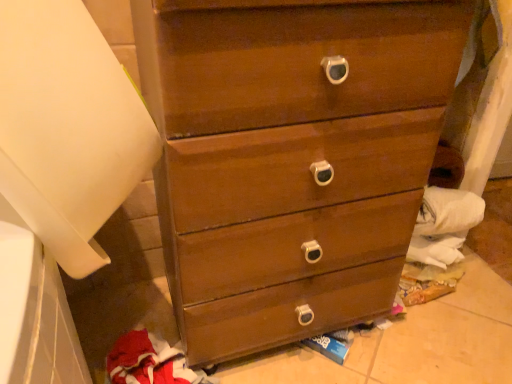
Question: From the image's perspective, relative to white matte paper towel at left, is matte wood chest of drawers at center above or below?

Choices:
 (A) below
 (B) above

Answer: (A)

Question: Looking at the image, does matte wood chest of drawers at center seem bigger or smaller compared to white matte paper towel at left?

Choices:
 (A) small
 (B) big

Answer: (B)

Question: Considering the real-world distances, which object is closest to the white matte paper towel at left?

Choices:
 (A) matte wood chest of drawers at center
 (B) red fleece sweatshirt at lower left

Answer: (A)

Question: Which is nearer to the white matte paper towel at left?

Choices:
 (A) matte wood chest of drawers at center
 (B) red fleece sweatshirt at lower left

Answer: (A)